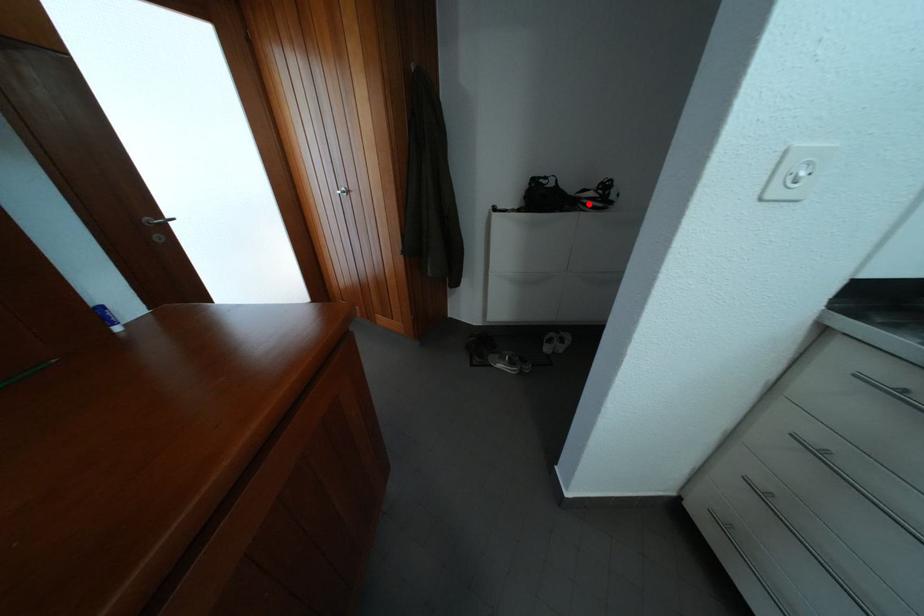
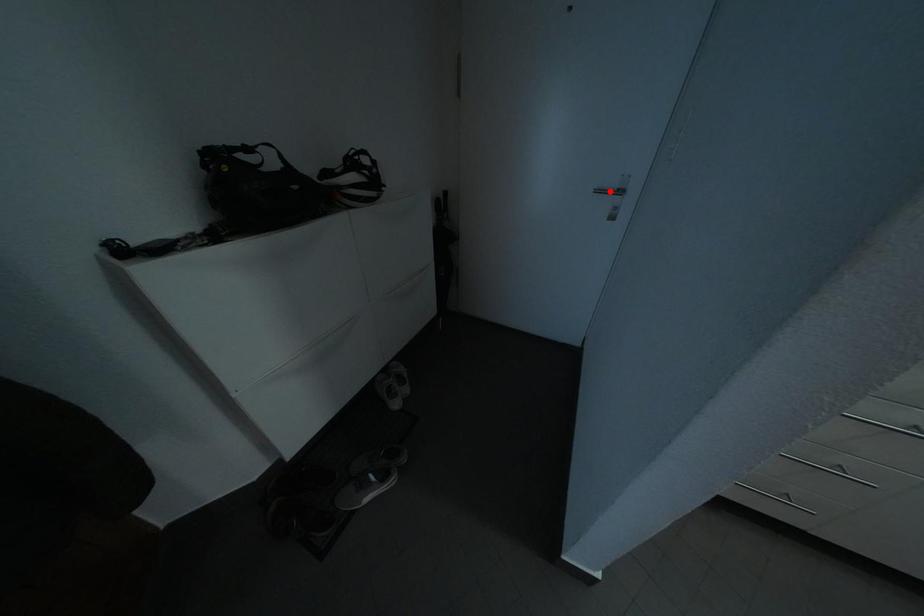
I am providing you with two images of the same scene from different viewpoints. A red point is marked on the first image and another point is marked on the second image. Does the point marked in image1 correspond to the same location as the one in image2?

No